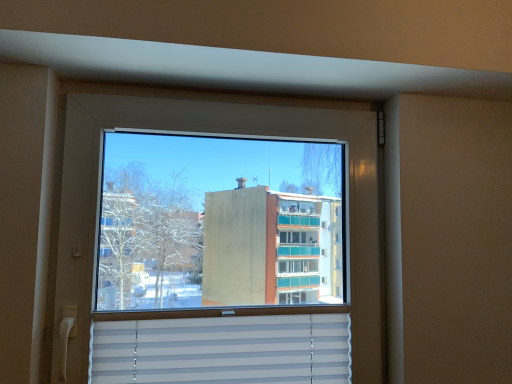
Question: Based on their sizes in the image, would you say transparent glass window at center is bigger or smaller than white plastic blinds at bottom?

Choices:
 (A) big
 (B) small

Answer: (A)

Question: Is transparent glass window at center taller or shorter than white plastic blinds at bottom?

Choices:
 (A) tall
 (B) short

Answer: (A)

Question: From a real-world perspective, is transparent glass window at center physically located above or below white plastic blinds at bottom?

Choices:
 (A) below
 (B) above

Answer: (B)

Question: Relative to transparent glass window at center, is white plastic blinds at bottom in front or behind?

Choices:
 (A) behind
 (B) front

Answer: (A)

Question: From the image's perspective, is white plastic blinds at bottom positioned above or below transparent glass window at center?

Choices:
 (A) above
 (B) below

Answer: (B)

Question: In terms of height, does white plastic blinds at bottom look taller or shorter compared to transparent glass window at center?

Choices:
 (A) tall
 (B) short

Answer: (B)

Question: In terms of size, does white plastic blinds at bottom appear bigger or smaller than transparent glass window at center?

Choices:
 (A) small
 (B) big

Answer: (A)